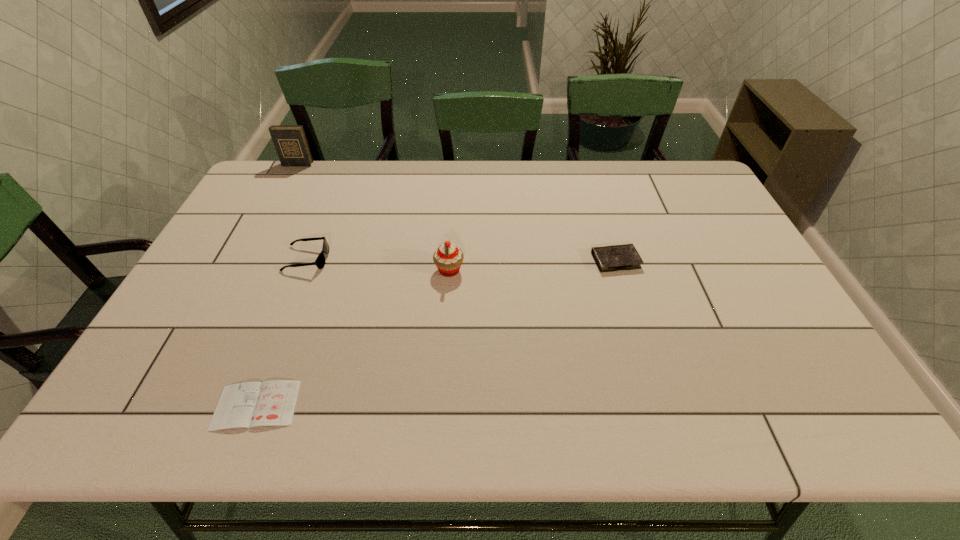
You are a GUI agent. You are given a task and a screenshot of the screen. Output one action in this format:
    pyautogui.click(x=<x>, y=<y>)
    Task: Click on the free space located on the back of the cupcake
    
    Given the screenshot: What is the action you would take?
    pyautogui.click(x=455, y=185)

I want to click on vacant space located 0.270m on the front-facing side of the third tallest object, so click(x=422, y=260).

Identify the location of blank space located 0.080m on the front of the rightmost object. (626, 295).

In order to click on free space located 0.230m on the right of the shortest diary in this screenshot , I will do coord(405,405).

At what (x,y) coordinates should I click in order to perform the action: click on object at the far edge. Please return your answer as a coordinate pair (x, y). This screenshot has height=540, width=960. Looking at the image, I should click on (290, 141).

I want to click on object present at the near edge, so click(272, 403).

Where is `object at the left edge`? This screenshot has width=960, height=540. object at the left edge is located at coordinates (290, 141).

Locate an element on the screen. The width and height of the screenshot is (960, 540). object at the far left corner is located at coordinates 290,141.

Locate an element on the screen. free space at the far edge of the desktop is located at coordinates pyautogui.click(x=625, y=164).

In the image, there is a desktop. Where is `vacant space at the near edge`? This screenshot has width=960, height=540. vacant space at the near edge is located at coordinates (309, 410).